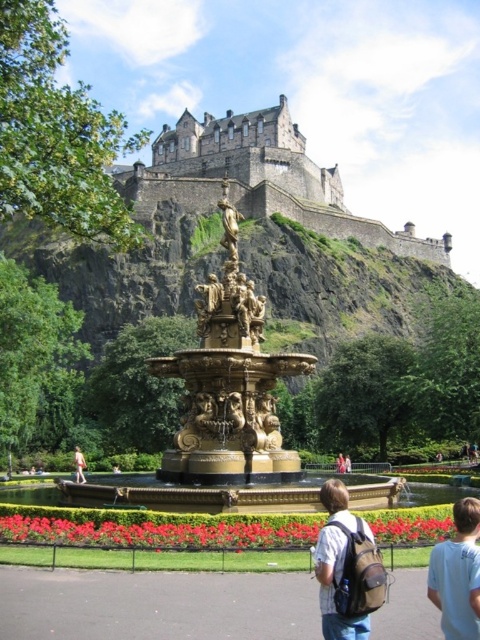
Does point (261, 156) come behind point (315, 570)?

Yes, it is behind point (315, 570).

Is brown stone castle at upper center thinner than brown leather backpack at lower center?

In fact, brown stone castle at upper center might be wider than brown leather backpack at lower center.

Between point (165, 177) and point (330, 634), which one is positioned in front?

Point (330, 634) is in front.

Find the location of a particular element. The image size is (480, 640). brown stone castle at upper center is located at coordinates (259, 179).

Who is lower down, light brown backpack at lower center or brown leather backpack at lower center?

brown leather backpack at lower center is lower down.

Can you confirm if light brown backpack at lower center is positioned to the left of brown leather backpack at lower center?

Indeed, light brown backpack at lower center is positioned on the left side of brown leather backpack at lower center.

Identify the location of light brown backpack at lower center. This screenshot has height=640, width=480. (346, 566).

At what (x,y) coordinates should I click in order to perform the action: click on light brown backpack at lower center. Please return your answer as a coordinate pair (x, y). Image resolution: width=480 pixels, height=640 pixels. Looking at the image, I should click on (346, 566).

Which is more to the right, brown stone castle at upper center or light brown backpack at lower center?

Positioned to the right is light brown backpack at lower center.

Can you confirm if brown stone castle at upper center is positioned to the right of light brown backpack at lower center?

In fact, brown stone castle at upper center is to the left of light brown backpack at lower center.

Does point (200, 186) come farther from viewer compared to point (375, 596)?

Yes, point (200, 186) is behind point (375, 596).

Locate an element on the screen. brown stone castle at upper center is located at coordinates pos(259,179).